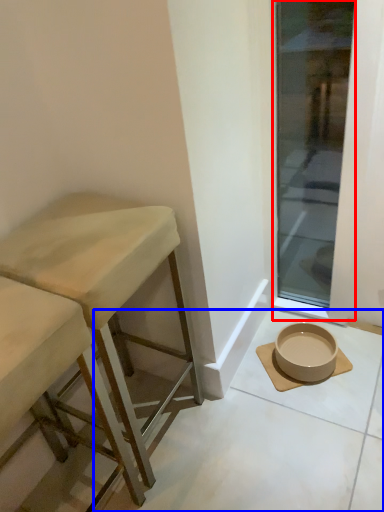
Question: Which object appears farthest to the camera in this image, window (highlighted by a red box) or concrete (highlighted by a blue box)?

Choices:
 (A) window
 (B) concrete

Answer: (A)